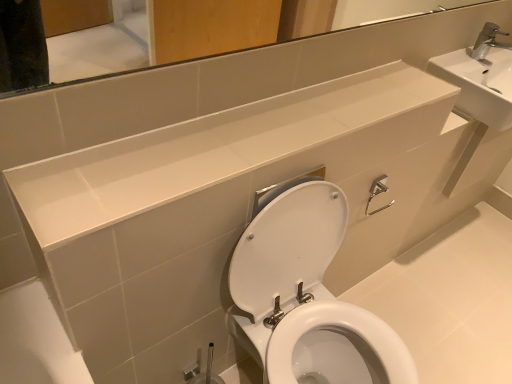
Where is `blank space situated above white glossy toilet at center (from a real-world perspective)`? This screenshot has width=512, height=384. blank space situated above white glossy toilet at center (from a real-world perspective) is located at coordinates (453, 294).